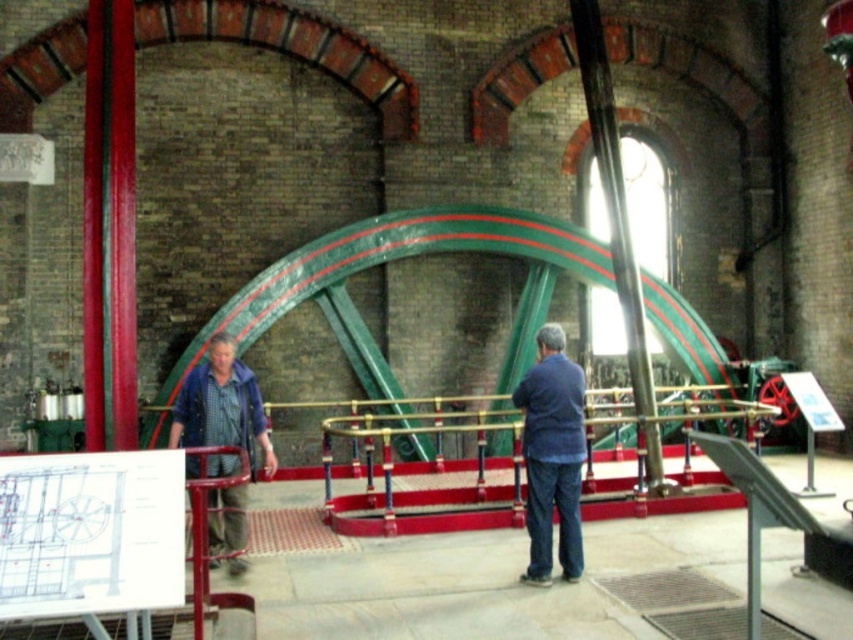
Does polished brass railing at center have a lesser height compared to blue denim jacket at center?

Indeed, polished brass railing at center has a lesser height compared to blue denim jacket at center.

Can you confirm if polished brass railing at center is positioned above blue denim jacket at center?

No.

Which is behind, point (444, 492) or point (550, 515)?

Point (444, 492)

Image resolution: width=853 pixels, height=640 pixels. What are the coordinates of `polished brass railing at center` in the screenshot? It's located at (424, 488).

Between blue denim jacket at center and denim jacket at left, which one has less height?

denim jacket at left is shorter.

Who is positioned more to the right, blue denim jacket at center or denim jacket at left?

Positioned to the right is blue denim jacket at center.

The height and width of the screenshot is (640, 853). In order to click on blue denim jacket at center in this screenshot , I will do `click(552, 456)`.

What are the coordinates of `blue denim jacket at center` in the screenshot? It's located at (552, 456).

Is polished brass railing at center thinner than denim jacket at left?

Indeed, polished brass railing at center has a lesser width compared to denim jacket at left.

Does point (323, 508) lie in front of point (233, 497)?

That is False.

The height and width of the screenshot is (640, 853). I want to click on polished brass railing at center, so click(x=424, y=488).